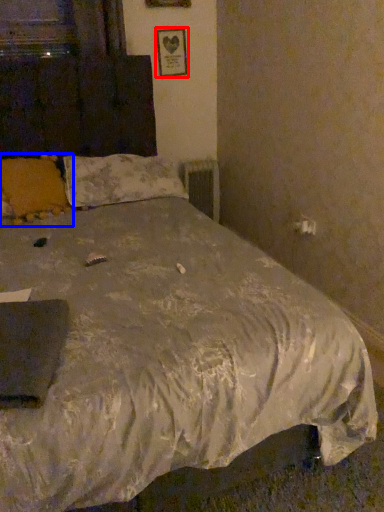
Question: Which object appears farthest to the camera in this image, picture frame (highlighted by a red box) or pillow (highlighted by a blue box)?

Choices:
 (A) picture frame
 (B) pillow

Answer: (A)